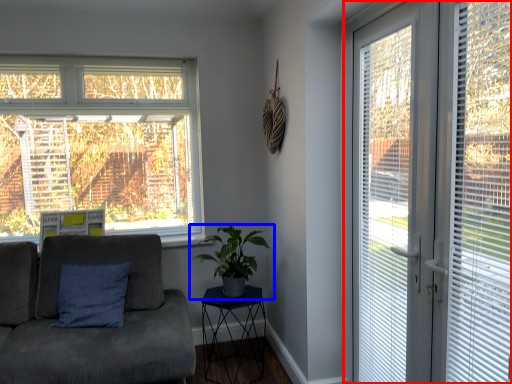
Question: Among these objects, which one is nearest to the camera, window (highlighted by a red box) or houseplant (highlighted by a blue box)?

Choices:
 (A) window
 (B) houseplant

Answer: (A)